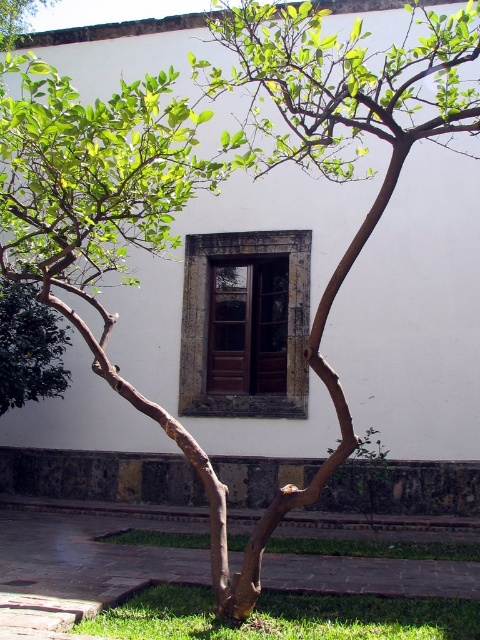
Question: Is brown wooden window at center closer to the viewer compared to green leafy tree at lower left?

Choices:
 (A) yes
 (B) no

Answer: (B)

Question: Can you confirm if green leafy tree at lower left is thinner than green leafy tree at center?

Choices:
 (A) yes
 (B) no

Answer: (B)

Question: Which point is closer to the camera?

Choices:
 (A) green leafy tree at lower left
 (B) brown wooden window at center

Answer: (A)

Question: Can you confirm if green leafy tree at lower left is positioned above green leafy tree at center?

Choices:
 (A) yes
 (B) no

Answer: (B)

Question: Estimate the real-world distances between objects in this image. Which object is farther from the brown wooden window at center?

Choices:
 (A) green leafy tree at center
 (B) green leafy tree at lower left

Answer: (A)

Question: Which of these objects is positioned closest to the green leafy tree at center?

Choices:
 (A) brown wooden window at center
 (B) green leafy tree at lower left

Answer: (A)